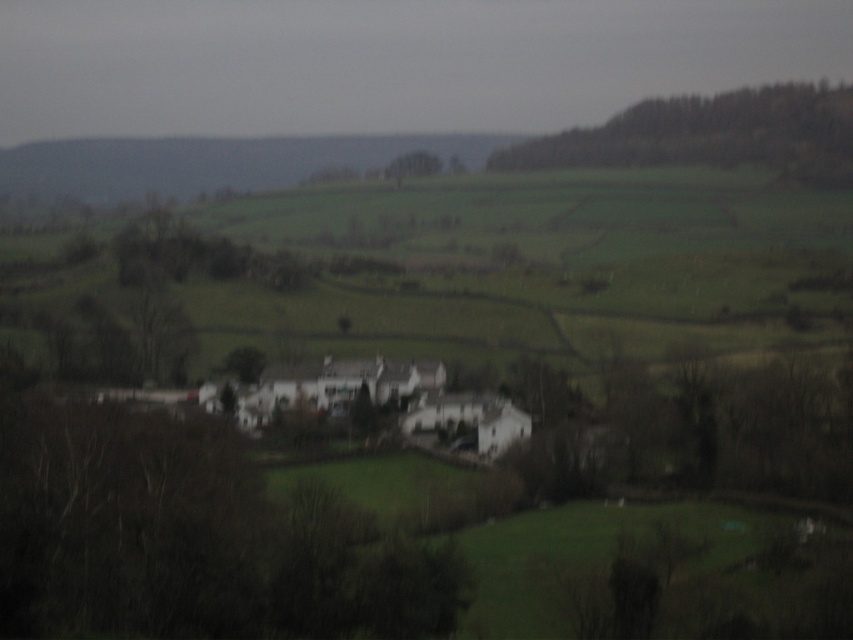
You are a landscape photographer planning to capture the rural landscape scene. You want to ensure that the green leafy tree at lower left and the green leafy trees at upper right are both visible in your photo. Given their sizes, which group of trees should you focus on to ensure they are fully captured in the frame?

The green leafy tree at lower left occupies less space than the green leafy trees at upper right, so you should focus on capturing the green leafy trees at upper right first as they take up more space in the scene.

You are a photographer standing at the edge of the rural landscape scene. You want to take a photo that includes both the point at coordinates point (166, 536) and point (831, 122). Since you want to ensure both points are in focus, which point should you focus on to maximize the depth of field?

You should focus on point (831, 122) because it is farther from the camera than point (166, 536). Focusing on the farther point will help ensure both points are within the depth of field.